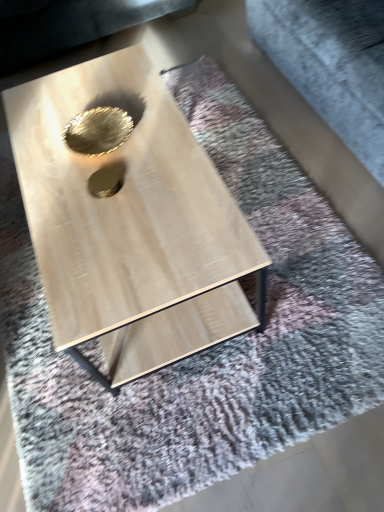
Question: Can we say gold metallic hole at center, the 2th hole in the back-to-front sequence, lies outside gray fabric at upper right?

Choices:
 (A) no
 (B) yes

Answer: (B)

Question: Is gold metallic hole at center, the 2th hole in the back-to-front sequence, far away from gray fabric at upper right?

Choices:
 (A) yes
 (B) no

Answer: (B)

Question: Can you confirm if gold metallic hole at center, which is the second hole in top-to-bottom order, is positioned to the right of gray fabric at upper right?

Choices:
 (A) yes
 (B) no

Answer: (B)

Question: Can you confirm if gold metallic hole at center, the 2th hole in the back-to-front sequence, is smaller than gray fabric at upper right?

Choices:
 (A) yes
 (B) no

Answer: (A)

Question: Does gold metallic hole at center, the 2th hole in the back-to-front sequence, come behind gray fabric at upper right?

Choices:
 (A) yes
 (B) no

Answer: (A)

Question: Does point pyautogui.click(x=112, y=119) appear closer or farther from the camera than point pyautogui.click(x=117, y=176)?

Choices:
 (A) closer
 (B) farther

Answer: (B)

Question: In terms of width, does gold metallic hole at center, which appears as the 2th hole when ordered from the bottom, look wider or thinner when compared to gold metallic hole at center, the 2th hole in the back-to-front sequence?

Choices:
 (A) thin
 (B) wide

Answer: (B)

Question: Is gold metallic hole at center, which appears as the 2th hole when ordered from the bottom, inside or outside of gold metallic hole at center, placed as the 1th hole when sorted from bottom to top?

Choices:
 (A) outside
 (B) inside

Answer: (A)

Question: From the image's perspective, is gold metallic hole at center, which is the 1th hole from top to bottom, above or below gold metallic hole at center, which is the second hole in top-to-bottom order?

Choices:
 (A) below
 (B) above

Answer: (B)

Question: Is gold metallic hole at center, placed as the 1th hole when sorted from bottom to top, situated inside gray fabric at upper right or outside?

Choices:
 (A) inside
 (B) outside

Answer: (B)

Question: Is gold metallic hole at center, placed as the 1th hole when sorted from bottom to top, bigger or smaller than gray fabric at upper right?

Choices:
 (A) big
 (B) small

Answer: (B)

Question: Considering the positions of gold metallic hole at center, the 2th hole in the back-to-front sequence, and gray fabric at upper right in the image, is gold metallic hole at center, the 2th hole in the back-to-front sequence, wider or thinner than gray fabric at upper right?

Choices:
 (A) wide
 (B) thin

Answer: (B)

Question: Would you say gold metallic hole at center, placed as the 1th hole when sorted from bottom to top, is to the left or to the right of gray fabric at upper right in the picture?

Choices:
 (A) left
 (B) right

Answer: (A)

Question: From the image's perspective, is gray fabric at upper right above or below gold metallic hole at center, which appears as the 2th hole when ordered from the bottom?

Choices:
 (A) below
 (B) above

Answer: (B)

Question: In terms of height, does gray fabric at upper right look taller or shorter compared to gold metallic hole at center, which appears as the 1th hole when viewed from the back?

Choices:
 (A) tall
 (B) short

Answer: (A)